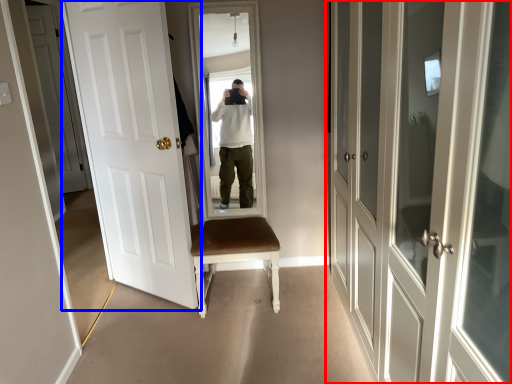
Question: Among these objects, which one is farthest to the camera, door (highlighted by a red box) or door (highlighted by a blue box)?

Choices:
 (A) door
 (B) door

Answer: (B)